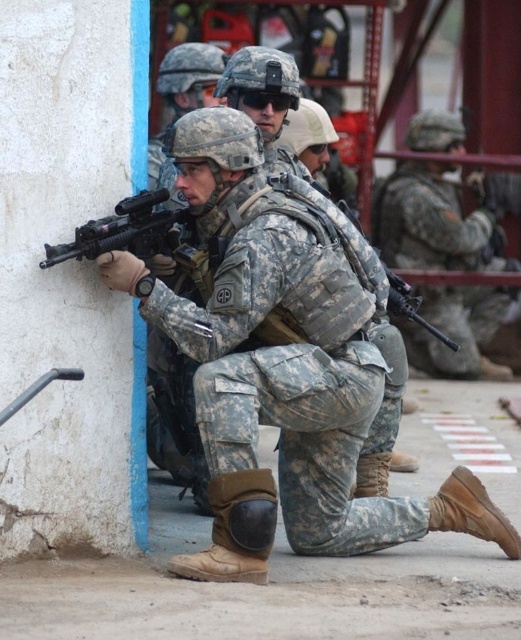
Between camouflage uniform at center and matte black rifle at left, which one is positioned higher?

camouflage uniform at center is higher up.

Which is more to the right, camouflage uniform at center or matte black rifle at left?

From the viewer's perspective, camouflage uniform at center appears more on the right side.

Between point (419, 237) and point (39, 264), which one is positioned in front?

Point (39, 264) is in front.

What are the coordinates of `camouflage uniform at center` in the screenshot? It's located at (430, 218).